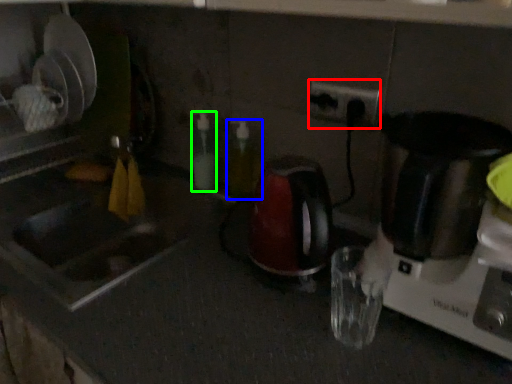
Question: Which object is the farthest from electric outlet (highlighted by a red box)? Choose among these: bottle (highlighted by a blue box) or bottle (highlighted by a green box).

Choices:
 (A) bottle
 (B) bottle

Answer: (B)